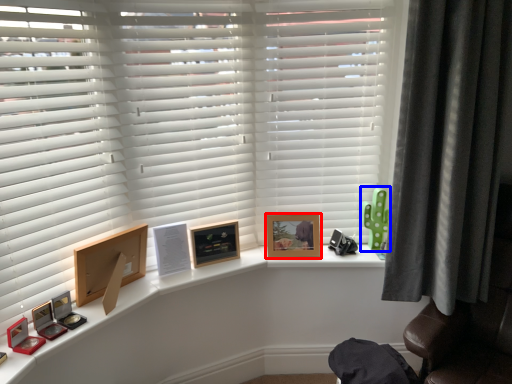
Question: Which object appears farthest to the camera in this image, picture frame (highlighted by a red box) or toy (highlighted by a blue box)?

Choices:
 (A) picture frame
 (B) toy

Answer: (B)